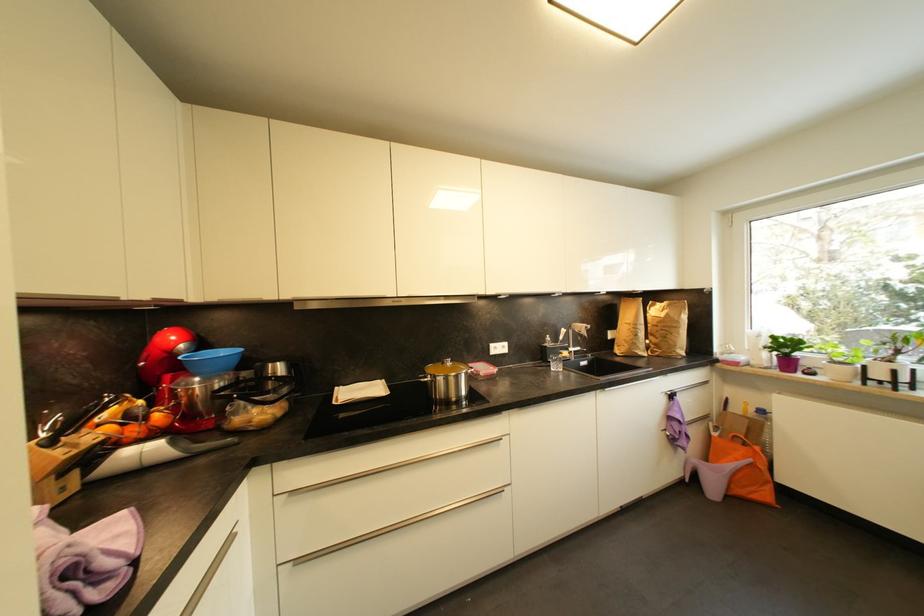
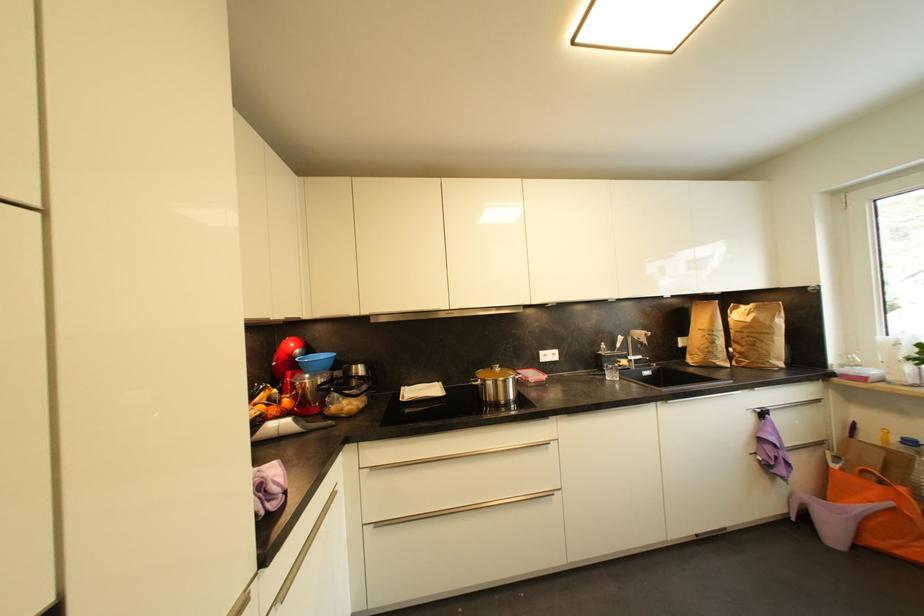
Locate, in the second image, the point that corresponds to the point at 176,355 in the first image.

(297, 359)